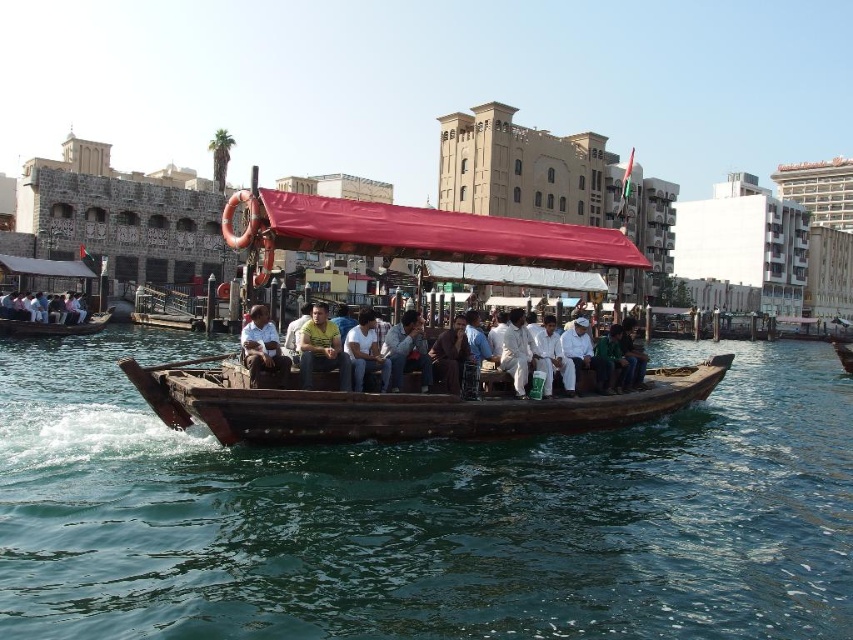
Is point (642, 257) farther from viewer compared to point (254, 355)?

Yes.

Which is in front, point (476, 252) or point (267, 337)?

Point (267, 337) is more forward.

At what (x,y) coordinates should I click in order to perform the action: click on wooden boat at center. Please return your answer as a coordinate pair (x, y). This screenshot has width=853, height=640. Looking at the image, I should click on (392, 404).

Can you confirm if brown wooden boat at center is shorter than white cotton shirt at center?

No, brown wooden boat at center is not shorter than white cotton shirt at center.

Who is more distant from viewer, (848,584) or (427,360)?

Point (427,360)

Where is `brown wooden boat at center`? The image size is (853, 640). brown wooden boat at center is located at coordinates (424, 515).

From the picture: Does brown wooden boat at center come in front of light brown wooden boat at center?

Yes.

Is brown wooden boat at center thinner than light brown wooden boat at center?

Incorrect, brown wooden boat at center's width is not less than light brown wooden boat at center's.

Who is more forward, (x=36, y=611) or (x=265, y=333)?

Point (x=36, y=611) is in front.

Find the location of a particular element. brown wooden boat at center is located at coordinates (424, 515).